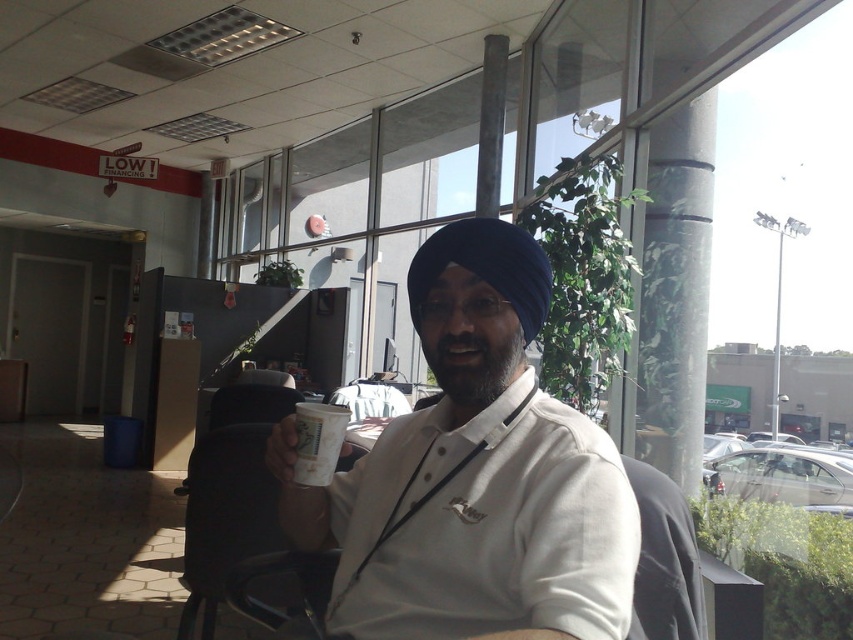
Question: Which object is positioned closest to the white matte shirt at center?

Choices:
 (A) black plastic chair at center
 (B) white paper cup at center

Answer: (B)

Question: Which object is closer to the camera taking this photo?

Choices:
 (A) white matte shirt at center
 (B) black plastic chair at center
 (C) white paper cup at center

Answer: (A)

Question: Does black plastic chair at center have a smaller size compared to white paper cup at center?

Choices:
 (A) yes
 (B) no

Answer: (B)

Question: Observing the image, what is the correct spatial positioning of white matte shirt at center in reference to white paper cup at center?

Choices:
 (A) right
 (B) left

Answer: (A)

Question: Can you confirm if white matte shirt at center is smaller than black plastic chair at center?

Choices:
 (A) no
 (B) yes

Answer: (B)

Question: Which object is closer to the camera taking this photo?

Choices:
 (A) black plastic chair at center
 (B) white matte shirt at center

Answer: (B)